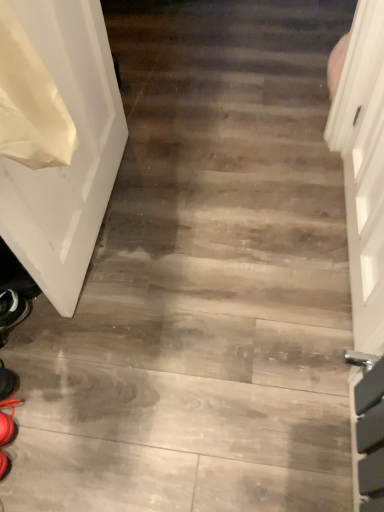
What do you see at coordinates (73, 155) in the screenshot? Image resolution: width=384 pixels, height=512 pixels. I see `white glossy door at left` at bounding box center [73, 155].

Where is `white glossy door at left`? This screenshot has width=384, height=512. white glossy door at left is located at coordinates (73, 155).

Locate an element on the screen. shiny black shoe at lower left is located at coordinates (8, 382).

Describe the element at coordinates (8, 382) in the screenshot. I see `shiny black shoe at lower left` at that location.

What is the approximate height of shiny black shoe at lower left?

shiny black shoe at lower left is 2.53 inches in height.

What are the coordinates of `white glossy door at left` in the screenshot? It's located at (73, 155).

Which object is positioned more to the right, white glossy door at left or shiny black shoe at lower left?

Positioned to the right is white glossy door at left.

Between white glossy door at left and shiny black shoe at lower left, which one is positioned behind?

shiny black shoe at lower left is behind.

Considering the positions of point (11, 201) and point (15, 383), is point (11, 201) closer or farther from the camera than point (15, 383)?

Point (11, 201) is closer to the camera than point (15, 383).

From the image's perspective, which is below, white glossy door at left or shiny black shoe at lower left?

From the image's view, shiny black shoe at lower left is below.

From a real-world perspective, is white glossy door at left above or below shiny black shoe at lower left?

white glossy door at left is above shiny black shoe at lower left.

Which of these two, white glossy door at left or shiny black shoe at lower left, is wider?

shiny black shoe at lower left is wider.

Between white glossy door at left and shiny black shoe at lower left, which one has more height?

white glossy door at left is taller.

Is white glossy door at left smaller than shiny black shoe at lower left?

No, white glossy door at left is not smaller than shiny black shoe at lower left.

Can shiny black shoe at lower left be found inside white glossy door at left?

No, shiny black shoe at lower left is not a part of white glossy door at left.

Is the surface of white glossy door at left in direct contact with shiny black shoe at lower left?

There is a gap between white glossy door at left and shiny black shoe at lower left.

Is white glossy door at left turned away from shiny black shoe at lower left?

Answer: No, shiny black shoe at lower left is not at the back of white glossy door at left.

How far apart are white glossy door at left and shiny black shoe at lower left?

The distance of white glossy door at left from shiny black shoe at lower left is 24.82 inches.

Identify the location of door lying above the shiny black shoe at lower left (from the image's perspective). (73, 155).

Can you confirm if shiny black shoe at lower left is positioned to the left of white glossy door at left?

Indeed, shiny black shoe at lower left is positioned on the left side of white glossy door at left.

Does shiny black shoe at lower left lie in front of white glossy door at left?

No, the depth of shiny black shoe at lower left is greater than that of white glossy door at left.

Between point (10, 381) and point (40, 176), which one is positioned behind?

The point (10, 381) is behind.

From the image's perspective, which is below, shiny black shoe at lower left or white glossy door at left?

shiny black shoe at lower left appears lower in the image.

From a real-world perspective, does shiny black shoe at lower left sit lower than white glossy door at left?

Correct, in the physical world, shiny black shoe at lower left is lower than white glossy door at left.

Is shiny black shoe at lower left wider than white glossy door at left?

Indeed, shiny black shoe at lower left has a greater width compared to white glossy door at left.

Can you confirm if shiny black shoe at lower left is taller than white glossy door at left?

No.

Considering the sizes of shiny black shoe at lower left and white glossy door at left in the image, is shiny black shoe at lower left bigger or smaller than white glossy door at left?

In the image, shiny black shoe at lower left appears to be smaller than white glossy door at left.

Is shiny black shoe at lower left located outside white glossy door at left?

shiny black shoe at lower left is positioned outside white glossy door at left.

Is shiny black shoe at lower left positioned far away from white glossy door at left?

Actually, shiny black shoe at lower left and white glossy door at left are a little close together.

Does shiny black shoe at lower left turn towards white glossy door at left?

No, shiny black shoe at lower left does not turn towards white glossy door at left.

The image size is (384, 512). I want to click on door on the right of shiny black shoe at lower left, so click(73, 155).

This screenshot has height=512, width=384. I want to click on shoe below the white glossy door at left (from the image's perspective), so click(8, 382).

What are the coordinates of `shoe that appears on the left of white glossy door at left` in the screenshot? It's located at (8, 382).